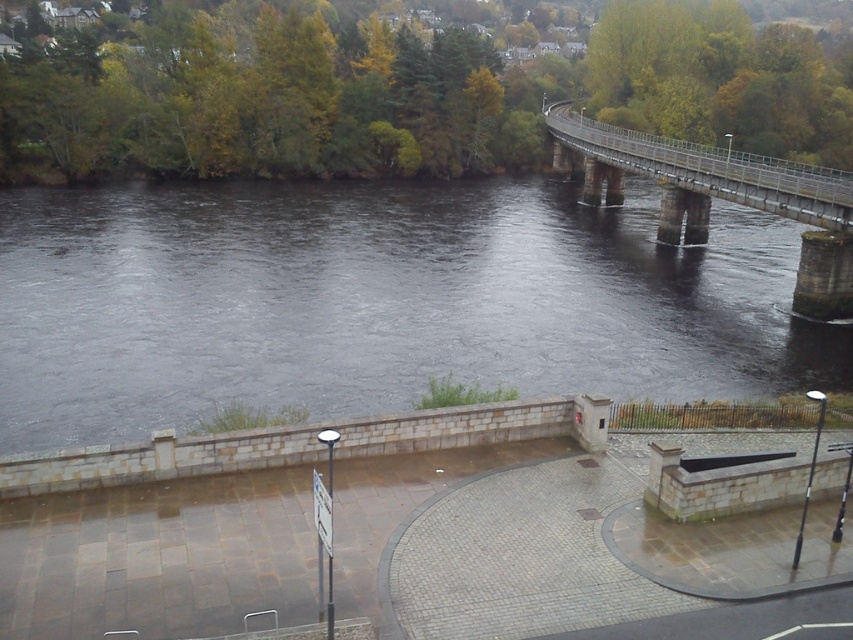
Is point (749, 348) in front of point (641, 148)?

Yes.

Can you confirm if dark gray water at center is positioned to the left of metallic gray bridge at upper right?

Yes, dark gray water at center is to the left of metallic gray bridge at upper right.

Which is behind, point (83, 282) or point (781, 188)?

The point (83, 282) is behind.

Locate an element on the screen. Image resolution: width=853 pixels, height=640 pixels. dark gray water at center is located at coordinates (378, 301).